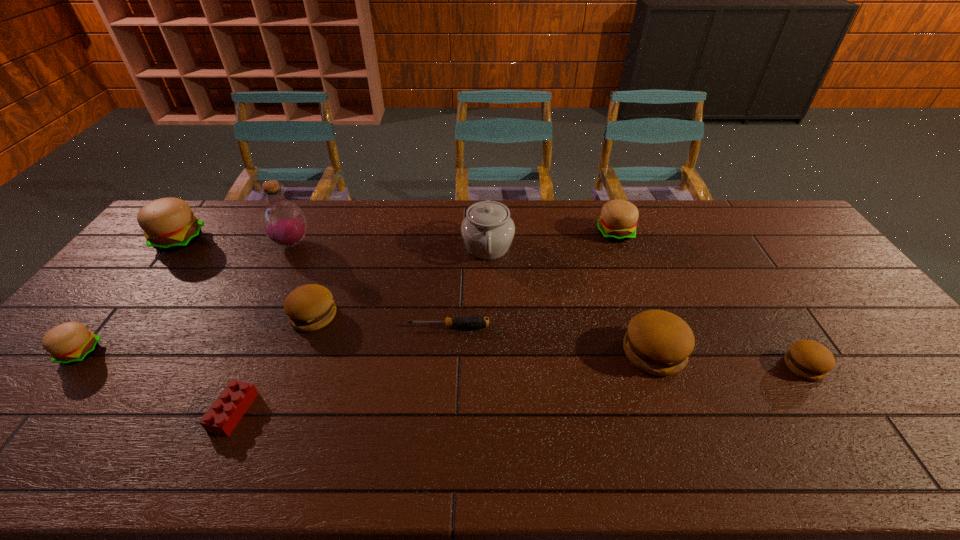
Where is `vacant position at the left edge of the desktop`? Image resolution: width=960 pixels, height=540 pixels. vacant position at the left edge of the desktop is located at coordinates (115, 320).

In the image, there is a desktop. At what (x,y) coordinates should I click in order to perform the action: click on vacant region at the far right corner. Please return your answer as a coordinate pair (x, y). Looking at the image, I should click on (760, 238).

Identify the location of free space between the fourth hamburger from right to left and the smallest beige hamburger. Image resolution: width=960 pixels, height=540 pixels. (197, 334).

Locate an element on the screen. This screenshot has width=960, height=540. empty space between the shortest object and the biggest beige hamburger is located at coordinates (314, 284).

I want to click on free area in between the smallest brown hamburger and the tallest object, so click(x=548, y=305).

Locate an element on the screen. The width and height of the screenshot is (960, 540). vacant region between the nearest beige hamburger and the purple bottle is located at coordinates (185, 298).

You are a GUI agent. You are given a task and a screenshot of the screen. Output one action in this format:
    pyautogui.click(x=<x>, y=<y>)
    Task: Click on the vacant space that's between the biggest beige hamburger and the screwdriver
    
    Given the screenshot: What is the action you would take?
    pyautogui.click(x=314, y=284)

What are the coordinates of `free space between the smallest beige hamburger and the leftmost brown hamburger` in the screenshot? It's located at (197, 334).

The image size is (960, 540). Find the location of `vacant area that lies between the smallest beige hamburger and the second brown hamburger from left to right`. vacant area that lies between the smallest beige hamburger and the second brown hamburger from left to right is located at coordinates (367, 352).

Identify the location of empty space that is in between the red Lego and the leftmost brown hamburger. (274, 363).